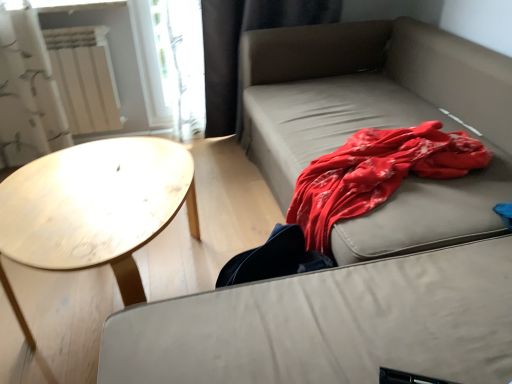
Question: Can you confirm if black fabric curtain at upper left is taller than matte beige studio couch at upper right?

Choices:
 (A) no
 (B) yes

Answer: (B)

Question: Could you tell me if black fabric curtain at upper left is turned towards matte beige studio couch at upper right?

Choices:
 (A) no
 (B) yes

Answer: (B)

Question: Does black fabric curtain at upper left have a smaller size compared to matte beige studio couch at upper right?

Choices:
 (A) yes
 (B) no

Answer: (A)

Question: Can you confirm if black fabric curtain at upper left is shorter than matte beige studio couch at upper right?

Choices:
 (A) no
 (B) yes

Answer: (A)

Question: From the image's perspective, is black fabric curtain at upper left on top of matte beige studio couch at upper right?

Choices:
 (A) yes
 (B) no

Answer: (A)

Question: From a real-world perspective, is black fabric curtain at upper left positioned above or below matte beige studio couch at upper right?

Choices:
 (A) above
 (B) below

Answer: (A)

Question: In terms of size, does black fabric curtain at upper left appear bigger or smaller than matte beige studio couch at upper right?

Choices:
 (A) big
 (B) small

Answer: (B)

Question: From the image's perspective, relative to matte beige studio couch at upper right, is black fabric curtain at upper left above or below?

Choices:
 (A) below
 (B) above

Answer: (B)

Question: Does point (204, 67) appear closer or farther from the camera than point (496, 228)?

Choices:
 (A) farther
 (B) closer

Answer: (A)

Question: Considering the positions of light wood/texture coffee table at left and black fabric curtain at upper left in the image, is light wood/texture coffee table at left wider or thinner than black fabric curtain at upper left?

Choices:
 (A) thin
 (B) wide

Answer: (B)

Question: Based on their positions, is light wood/texture coffee table at left located to the left or right of black fabric curtain at upper left?

Choices:
 (A) left
 (B) right

Answer: (A)

Question: Choose the correct answer: Is light wood/texture coffee table at left inside black fabric curtain at upper left or outside it?

Choices:
 (A) inside
 (B) outside

Answer: (B)

Question: Does point (70, 240) appear closer or farther from the camera than point (280, 6)?

Choices:
 (A) farther
 (B) closer

Answer: (B)

Question: Visually, is matte beige studio couch at upper right positioned to the left or to the right of black fabric curtain at upper left?

Choices:
 (A) right
 (B) left

Answer: (A)

Question: Which is correct: matte beige studio couch at upper right is inside black fabric curtain at upper left, or outside of it?

Choices:
 (A) outside
 (B) inside

Answer: (A)